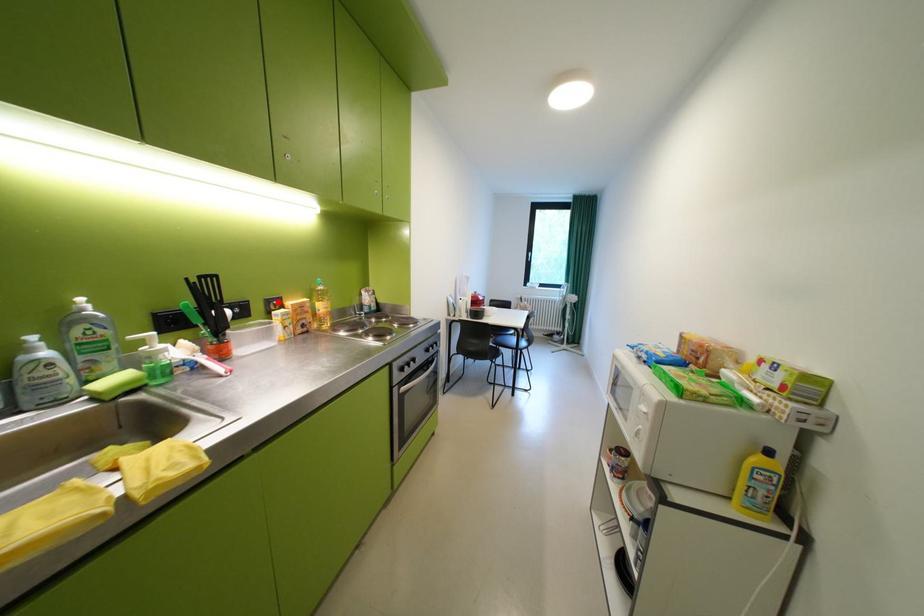
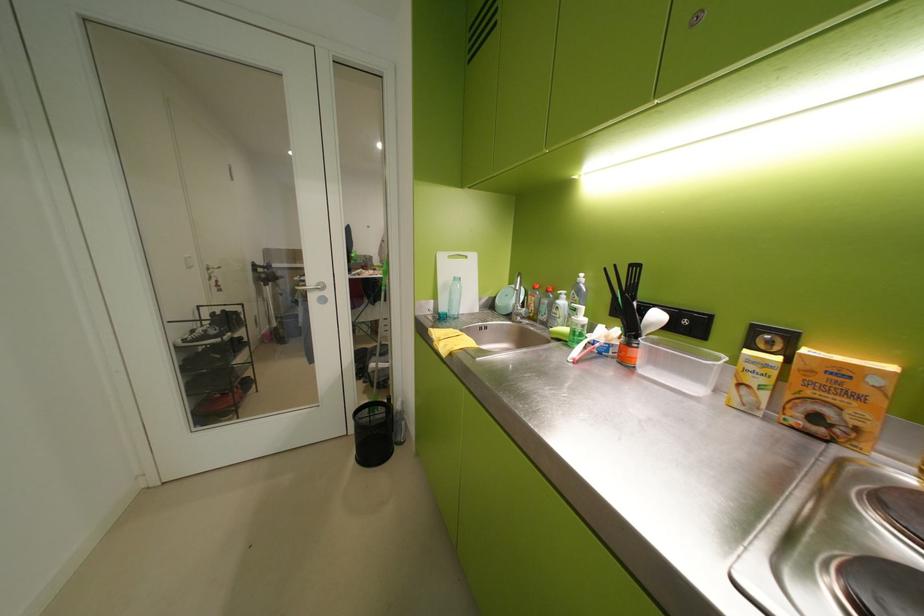
The point at the highlighted location is marked in the first image. Where is the corresponding point in the second image?

(767, 331)